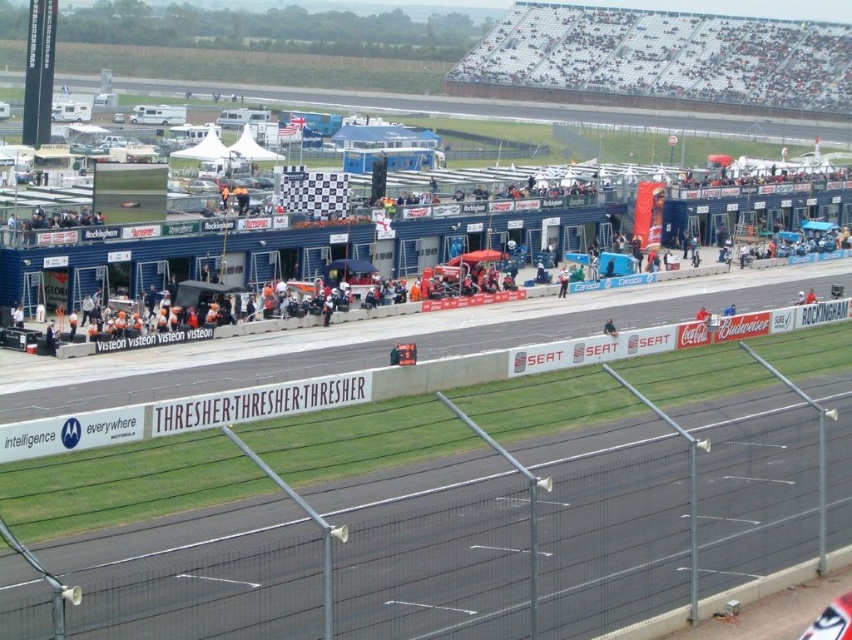
Question: Can you confirm if white plastic banner at center is positioned above white fabric umbrella at center?

Choices:
 (A) no
 (B) yes

Answer: (A)

Question: Which point is closer to the camera taking this photo?

Choices:
 (A) (561, 268)
 (B) (216, 404)

Answer: (B)

Question: Is white plastic banner at center to the left of white fabric umbrella at center from the viewer's perspective?

Choices:
 (A) no
 (B) yes

Answer: (B)

Question: Does white plastic banner at center have a larger size compared to white fabric umbrella at center?

Choices:
 (A) no
 (B) yes

Answer: (B)

Question: Which object appears farthest from the camera in this image?

Choices:
 (A) white fabric umbrella at center
 (B) white plastic banner at center

Answer: (A)

Question: Which point is closer to the camera taking this photo?

Choices:
 (A) coord(563,291)
 (B) coord(234,406)

Answer: (B)